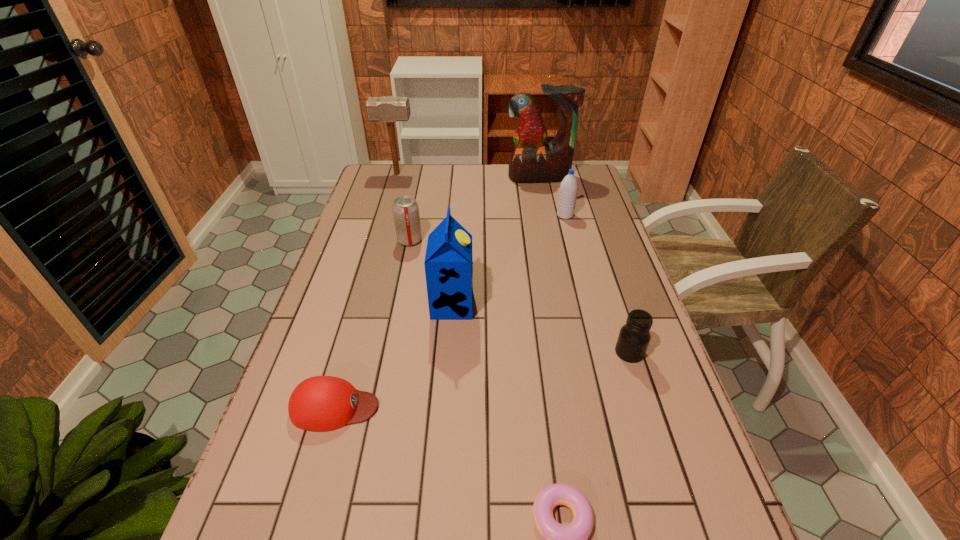
This screenshot has height=540, width=960. Find the location of `the tallest object`. the tallest object is located at coordinates (532, 161).

Find the location of a particular element. This screenshot has height=540, width=960. mallet is located at coordinates 390,109.

Where is `carton`? carton is located at coordinates (448, 263).

The width and height of the screenshot is (960, 540). Identify the location of the fifth farthest object. (448, 263).

This screenshot has width=960, height=540. I want to click on the fourth tallest object, so click(568, 191).

The width and height of the screenshot is (960, 540). In order to click on water bottle in this screenshot , I will do `click(568, 191)`.

The image size is (960, 540). I want to click on the fourth shortest object, so click(x=405, y=209).

Locate an element on the screen. Image resolution: width=960 pixels, height=540 pixels. the fifth nearest object is located at coordinates (405, 209).

Image resolution: width=960 pixels, height=540 pixels. I want to click on the third nearest object, so click(x=634, y=337).

Identify the location of jar. (634, 337).